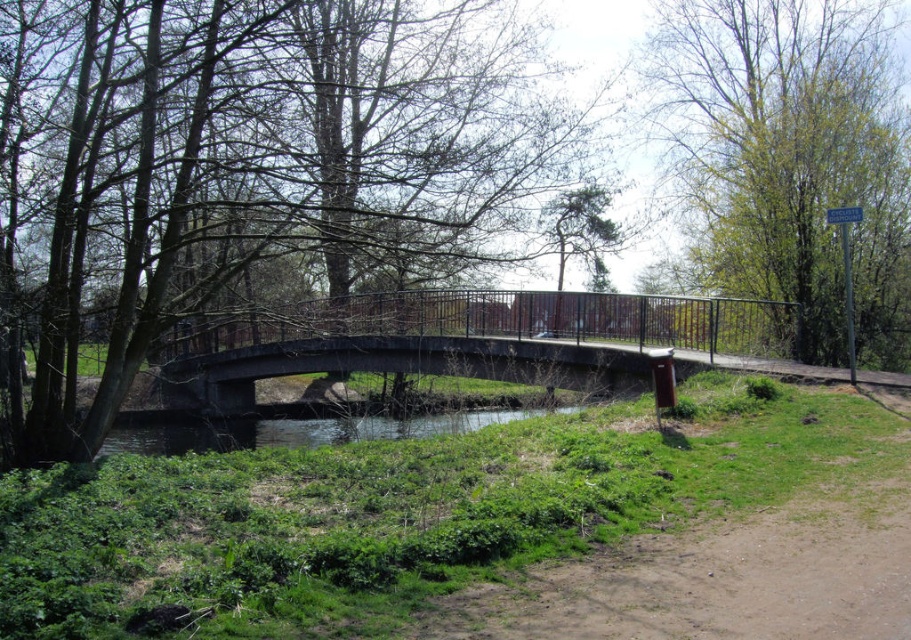
Question: Which object is the farthest from the concrete bridge at center?

Choices:
 (A) green leafy tree at upper right
 (B) clear water at center
 (C) brown wood tree at center

Answer: (A)

Question: Is concrete bridge at center in front of clear water at center?

Choices:
 (A) yes
 (B) no

Answer: (A)

Question: From the image, what is the correct spatial relationship of concrete bridge at center in relation to green leafy tree at upper right?

Choices:
 (A) below
 (B) above

Answer: (A)

Question: Which point is farther from the camera taking this photo?

Choices:
 (A) 14,476
 (B) 193,433
 (C) 835,252
 (D) 119,104

Answer: (B)

Question: Based on their relative distances, which object is nearer to the concrete bridge at center?

Choices:
 (A) clear water at center
 (B) brown wood tree at center

Answer: (A)

Question: In this image, where is concrete bridge at center located relative to green leafy tree at upper right?

Choices:
 (A) above
 (B) below

Answer: (B)